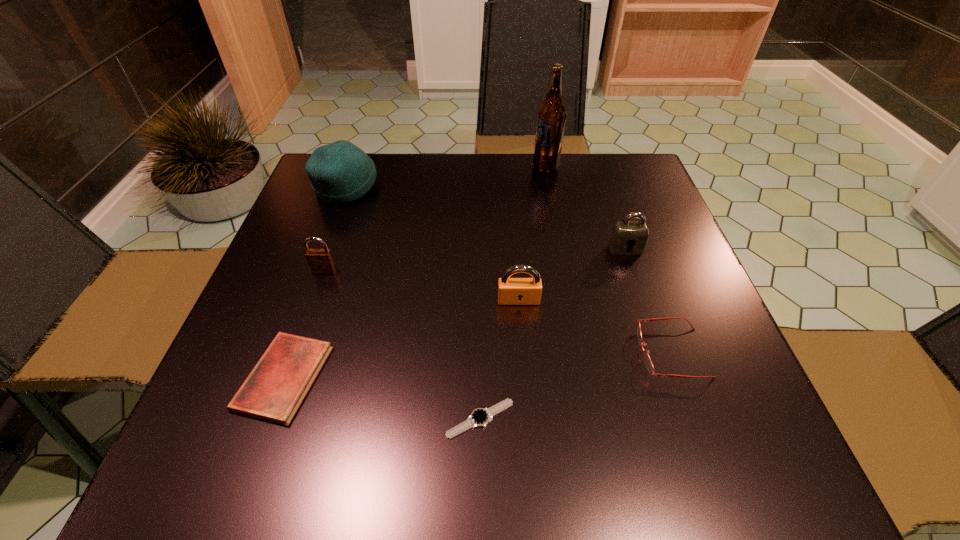
This screenshot has width=960, height=540. Identify the location of vacant space located 0.400m on the lenses of the third shortest object. (413, 353).

The width and height of the screenshot is (960, 540). I want to click on vacant space situated on the lenses of the third shortest object, so click(x=548, y=353).

Locate an element on the screen. The image size is (960, 540). vacant position located on the back of the diary is located at coordinates (325, 260).

Identify the location of vacant space located on the back of the watch. This screenshot has width=960, height=540. (480, 298).

You are a GUI agent. You are given a task and a screenshot of the screen. Output one action in this format:
    pyautogui.click(x=<x>, y=<y>)
    Task: Click on the beer bottle that is at the far edge
    This screenshot has height=540, width=960.
    Given the screenshot: What is the action you would take?
    pyautogui.click(x=551, y=116)

Image resolution: width=960 pixels, height=540 pixels. I want to click on beanie situated at the far edge, so click(340, 172).

In order to click on diary present at the near edge in this screenshot , I will do `click(273, 391)`.

You are a GUI agent. You are given a task and a screenshot of the screen. Output one action in this format:
    pyautogui.click(x=<x>, y=<y>)
    Task: Click on the watch that is at the near edge
    This screenshot has height=540, width=960.
    Given the screenshot: What is the action you would take?
    pyautogui.click(x=480, y=417)

You are a GUI agent. You are given a task and a screenshot of the screen. Output one action in this format:
    pyautogui.click(x=<x>, y=<y>)
    Task: Click on the beanie that is at the left edge
    The height and width of the screenshot is (540, 960).
    Given the screenshot: What is the action you would take?
    pyautogui.click(x=340, y=172)

In order to click on padlock that is at the left edge in this screenshot , I will do `click(320, 261)`.